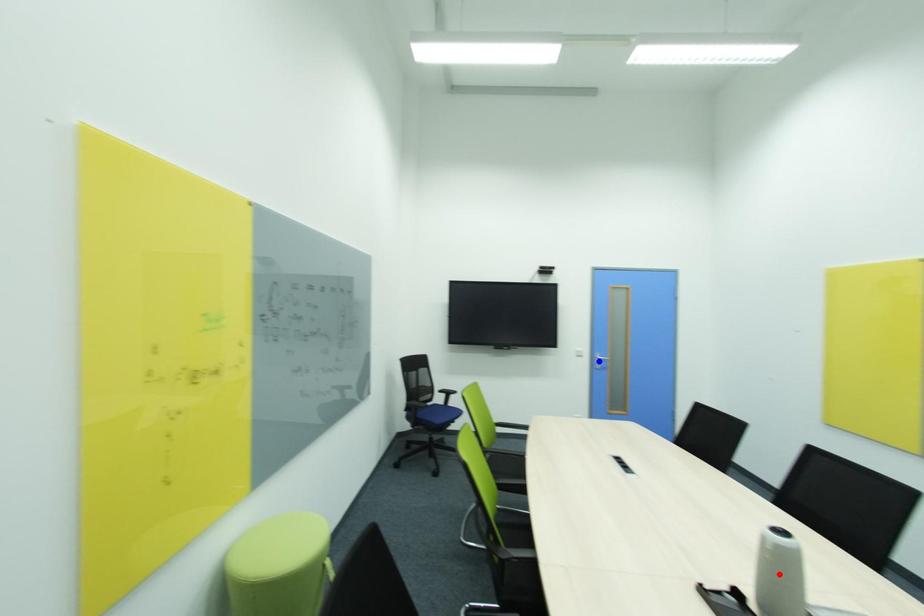
Question: In the image, two points are highlighted. Which point is nearer to the camera? Reply with the corresponding letter.

Choices:
 (A) blue point
 (B) red point

Answer: (B)